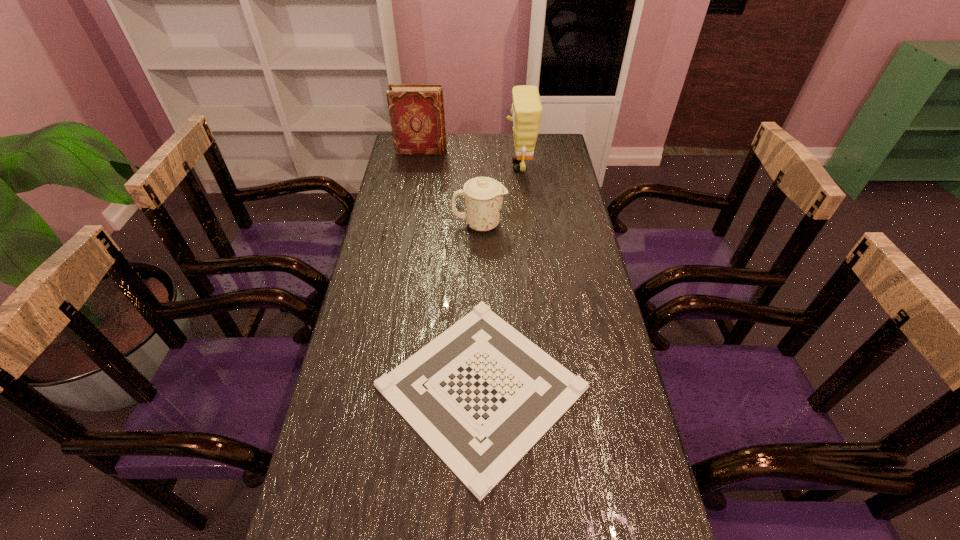
Where is `vacant space located on the spout of the chinaware`? vacant space located on the spout of the chinaware is located at coordinates (552, 225).

Locate an element on the screen. sponge that is at the far edge is located at coordinates (526, 110).

Locate an element on the screen. Image resolution: width=960 pixels, height=540 pixels. hardback book that is at the far edge is located at coordinates (416, 111).

Locate an element on the screen. This screenshot has height=540, width=960. hardback book located in the left edge section of the desktop is located at coordinates (416, 111).

Find the location of a particular element. checkerboard that is at the left edge is located at coordinates (481, 395).

Find the location of `sponge positioned at the right edge`. sponge positioned at the right edge is located at coordinates (526, 110).

Identify the location of checkerboard at the right edge. (481, 395).

I want to click on object located at the far left corner, so click(416, 111).

Where is `object at the far right corner`? object at the far right corner is located at coordinates (526, 110).

In the image, there is a desktop. Where is `free space at the far edge`? free space at the far edge is located at coordinates (477, 153).